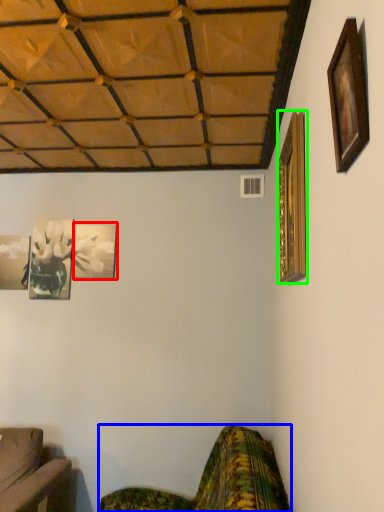
Question: Estimate the real-world distances between objects in this image. Which object is farther from picture frame (highlighted by a red box), studio couch (highlighted by a blue box) or picture frame (highlighted by a green box)?

Choices:
 (A) studio couch
 (B) picture frame

Answer: (B)